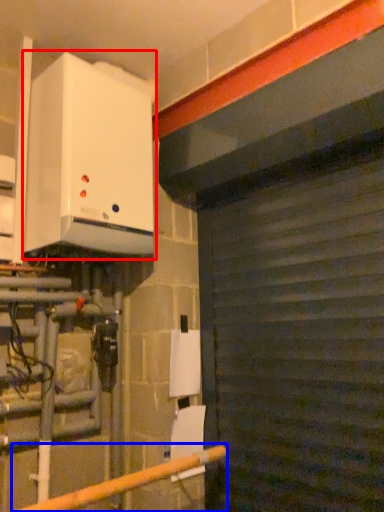
Question: Which of the following is the farthest to the observer, home appliance (highlighted by a red box) or rail (highlighted by a blue box)?

Choices:
 (A) home appliance
 (B) rail

Answer: (A)